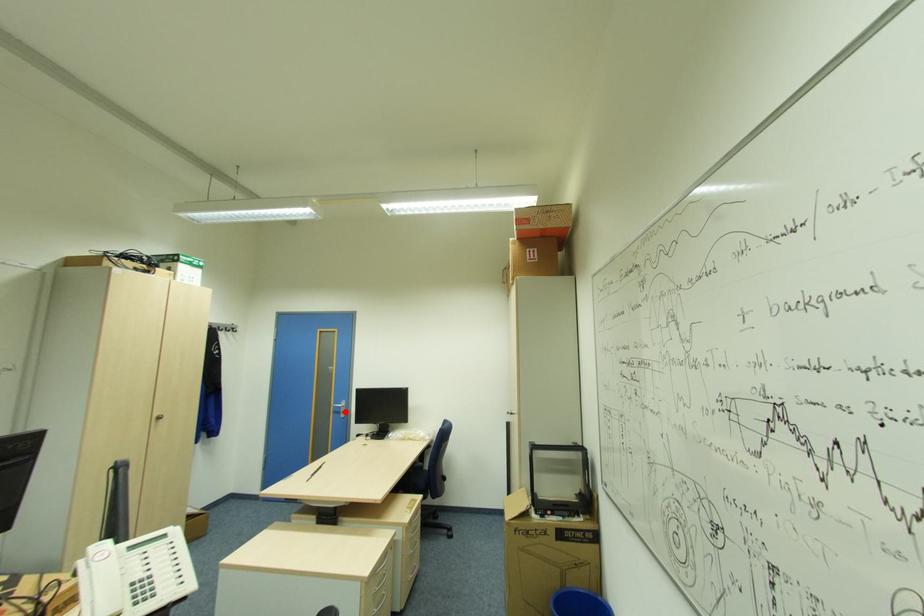
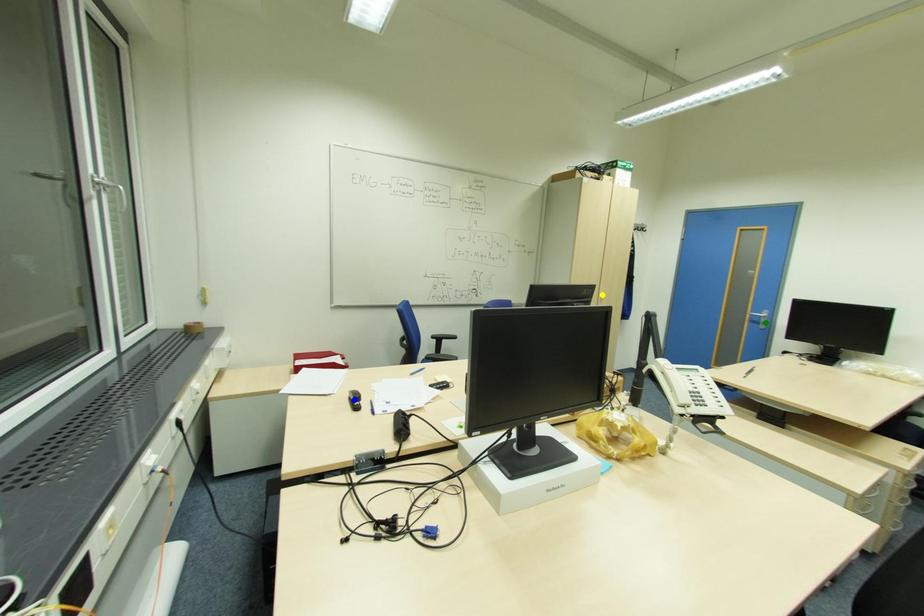
Question: I am providing you with two images of the same scene from different viewpoints. A red point is marked on the first image. You are given multiple points on the second image. Which spot in image 2 lines up with the point in image 1?

Choices:
 (A) yellow point
 (B) green point
 (C) blue point

Answer: (B)